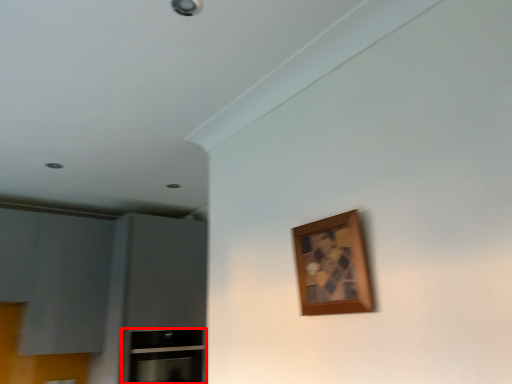
Question: From the image's perspective, where is cabinetry (annotated by the red box) located relative to picture frame?

Choices:
 (A) above
 (B) below

Answer: (B)